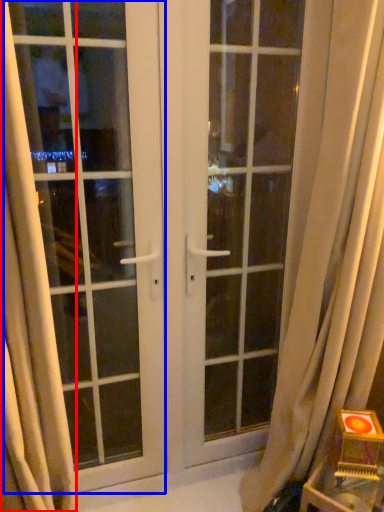
Question: Which object appears farthest to the camera in this image, curtain (highlighted by a red box) or window (highlighted by a blue box)?

Choices:
 (A) curtain
 (B) window

Answer: (B)